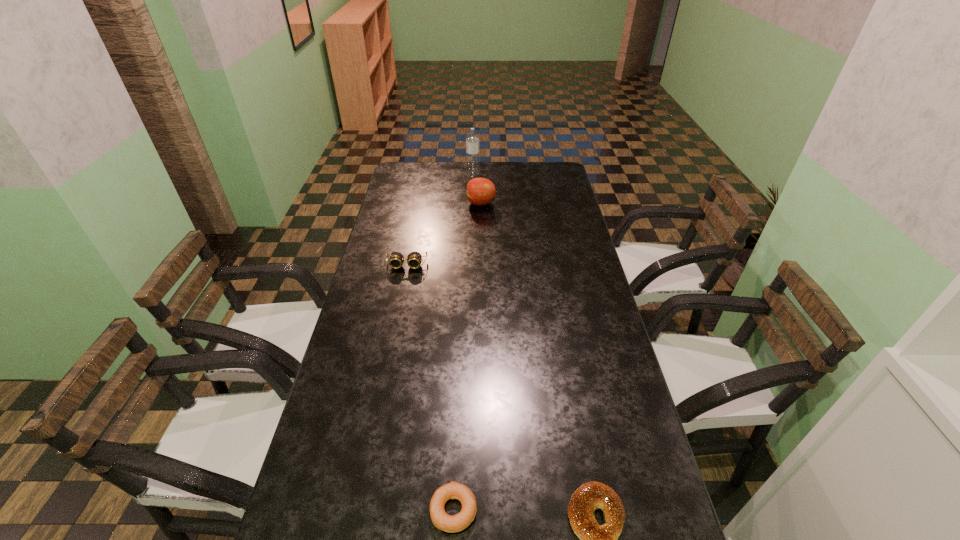
The width and height of the screenshot is (960, 540). I want to click on blank space located on the left of the left bagel, so click(316, 510).

Locate an element on the screen. The image size is (960, 540). object that is at the far edge is located at coordinates (472, 138).

Where is `object that is at the left edge`? The image size is (960, 540). object that is at the left edge is located at coordinates (414, 259).

The height and width of the screenshot is (540, 960). In the image, there is a desktop. What are the coordinates of `vacant space at the far edge` in the screenshot? It's located at (518, 176).

Find the location of a particular element. Image resolution: width=960 pixels, height=540 pixels. blank space at the left edge is located at coordinates (409, 187).

The height and width of the screenshot is (540, 960). In order to click on free region at the right edge of the desktop in this screenshot , I will do `click(624, 386)`.

Where is `vacant space at the far right corner of the desktop`? This screenshot has height=540, width=960. vacant space at the far right corner of the desktop is located at coordinates click(569, 186).

Where is `empty location between the third shortest object and the apple`? The width and height of the screenshot is (960, 540). empty location between the third shortest object and the apple is located at coordinates (444, 234).

Where is `empty space between the farthest object and the leftmost object`? This screenshot has height=540, width=960. empty space between the farthest object and the leftmost object is located at coordinates (440, 220).

Image resolution: width=960 pixels, height=540 pixels. I want to click on unoccupied area between the water bottle and the leftmost object, so click(440, 220).